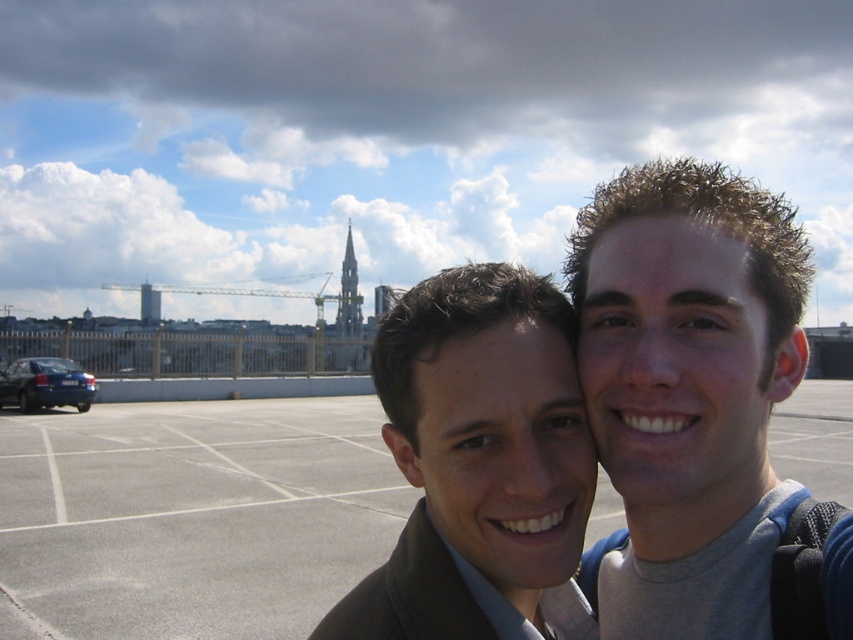
The height and width of the screenshot is (640, 853). In order to click on matte black jacket at center in this screenshot , I will do `click(476, 460)`.

Measure the distance between matte black jacket at center and blue metallic sedan at lower left.

A distance of 89.09 feet exists between matte black jacket at center and blue metallic sedan at lower left.

Is point (386, 586) positioned after point (80, 396)?

No, it is in front of (80, 396).

Locate an element on the screen. The width and height of the screenshot is (853, 640). matte black jacket at center is located at coordinates (476, 460).

Locate an element on the screen. The width and height of the screenshot is (853, 640). gray concrete parking lot at center is located at coordinates (190, 516).

Is gray concrete parking lot at center thinner than matte black jacket at center?

Incorrect, gray concrete parking lot at center's width is not less than matte black jacket at center's.

At what (x,y) coordinates should I click in order to perform the action: click on gray concrete parking lot at center. Please return your answer as a coordinate pair (x, y). This screenshot has height=640, width=853. Looking at the image, I should click on (190, 516).

Where is `gray concrete parking lot at center`? The height and width of the screenshot is (640, 853). gray concrete parking lot at center is located at coordinates (190, 516).

Who is shorter, matte brown jacket at center or matte black jacket at center?

With less height is matte black jacket at center.

I want to click on matte brown jacket at center, so pyautogui.click(x=698, y=408).

Is point (607, 609) more distant than point (424, 282)?

That is True.

What are the coordinates of `matte brown jacket at center` in the screenshot? It's located at (698, 408).